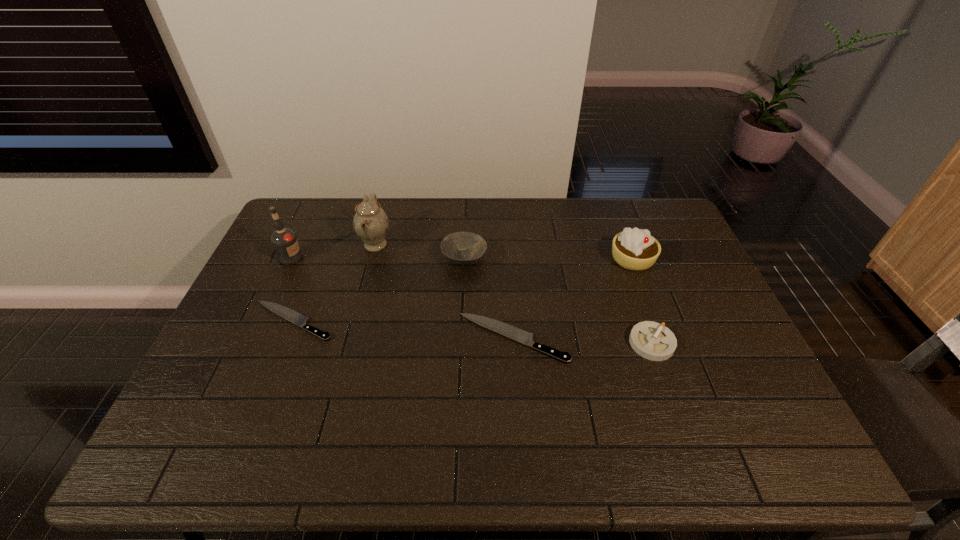
Identify the location of vacant area that satisfies the following two spatial constraints: 1. on the spout of the chinaware; 2. on the back side of the bowl. (372, 258).